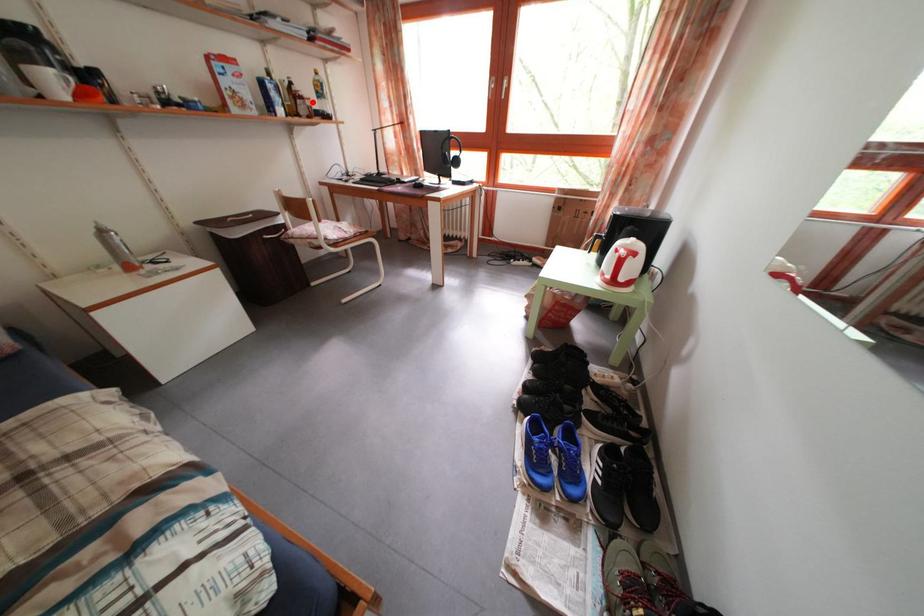
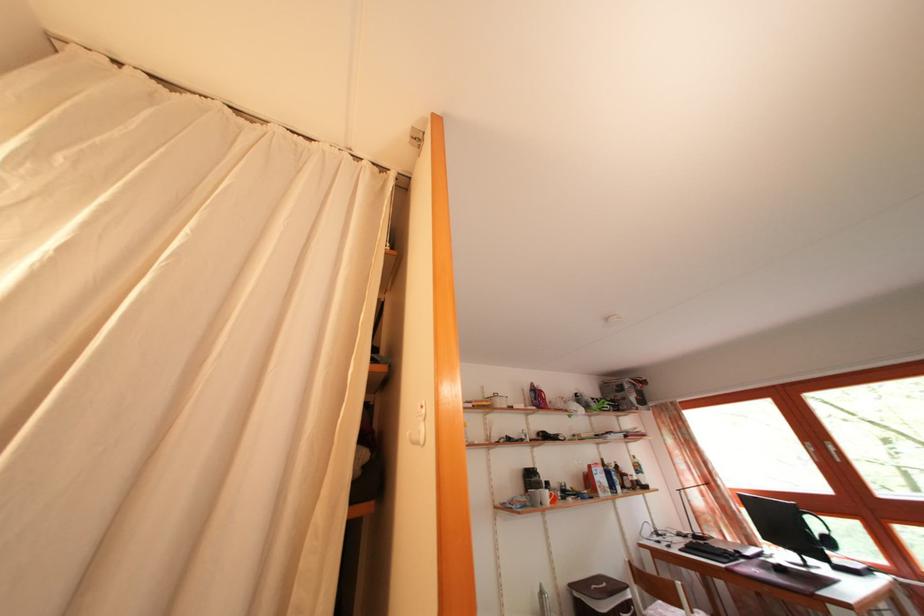
Question: I am providing you with two images of the same scene from different viewpoints. Given a red point in image1, look at the same physical point in image2. Is it:

Choices:
 (A) Closer to the viewpoint
 (B) Farther from the viewpoint

Answer: (B)